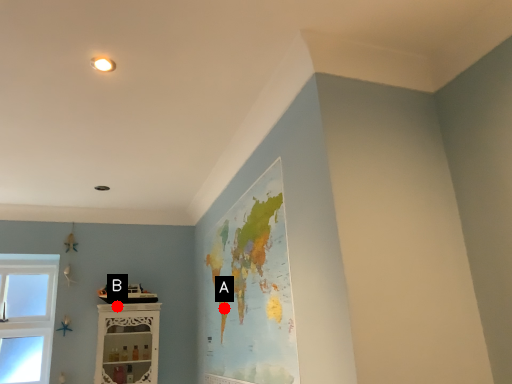
Question: Two points are circled on the image, labeled by A and B beside each circle. Which of the following is the farthest from the observer?

Choices:
 (A) A is further
 (B) B is further

Answer: (B)